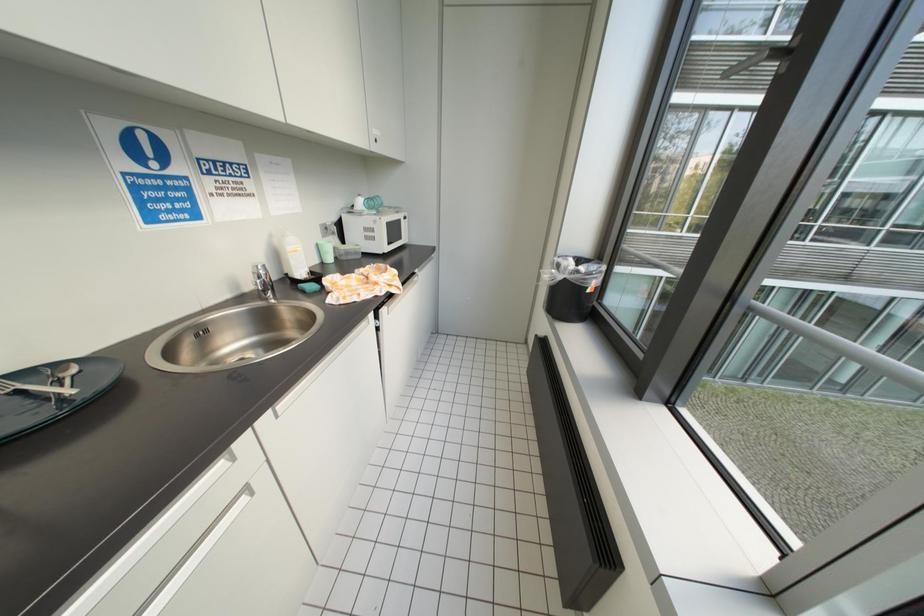
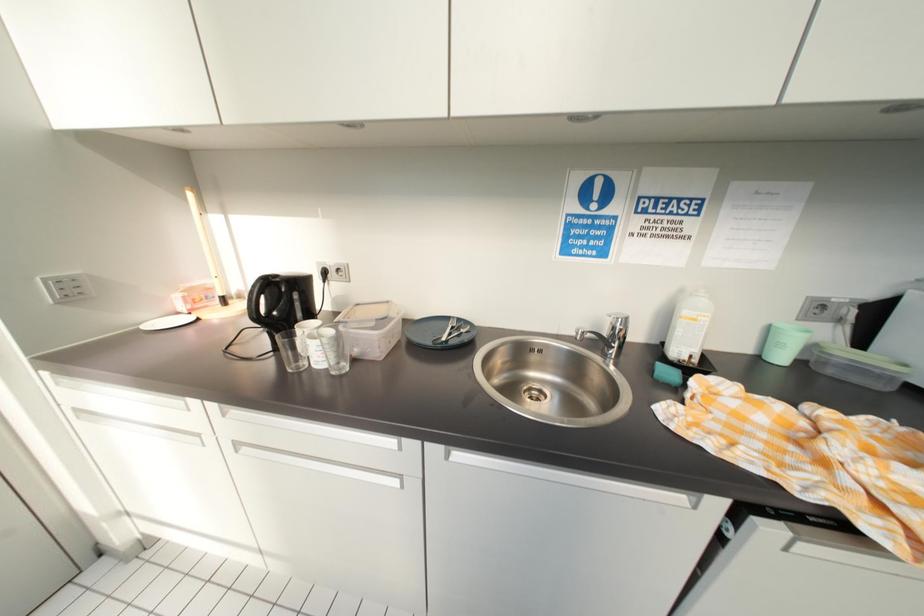
How did the camera likely rotate?

The camera rotated toward left-down.